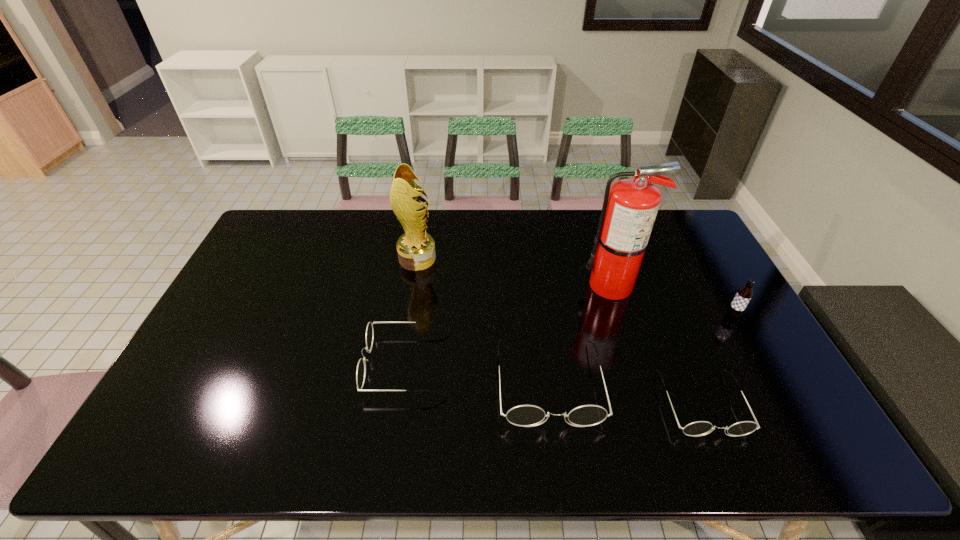
The height and width of the screenshot is (540, 960). In order to click on vacant space that satisfies the following two spatial constraints: 1. at the nozzle of the fire extinguisher; 2. on the front-facing side of the second spectacles from right to left in this screenshot , I will do `click(642, 383)`.

Find the location of a particular element. blank area in the image that satisfies the following two spatial constraints: 1. on the front-facing side of the award; 2. on the left side of the rightmost object is located at coordinates (408, 316).